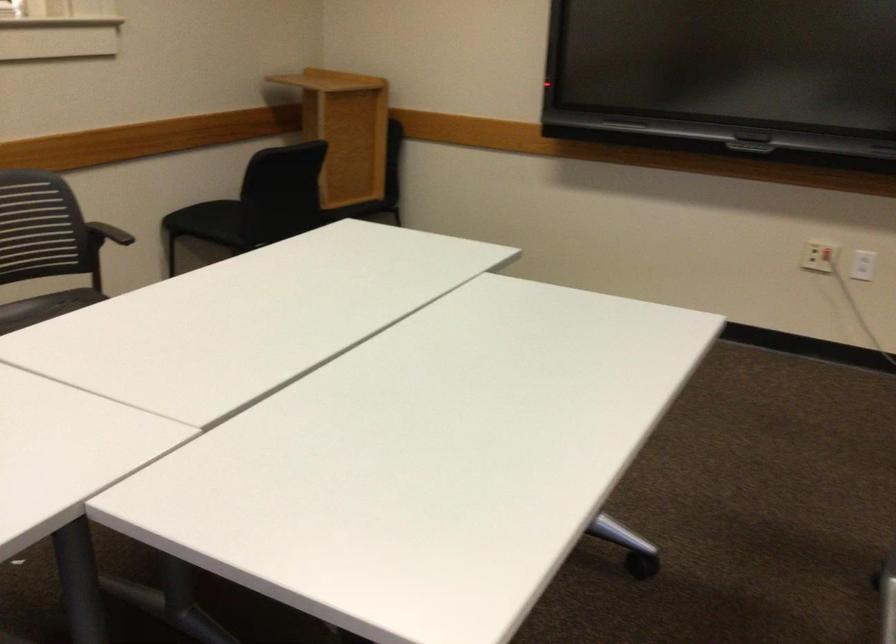
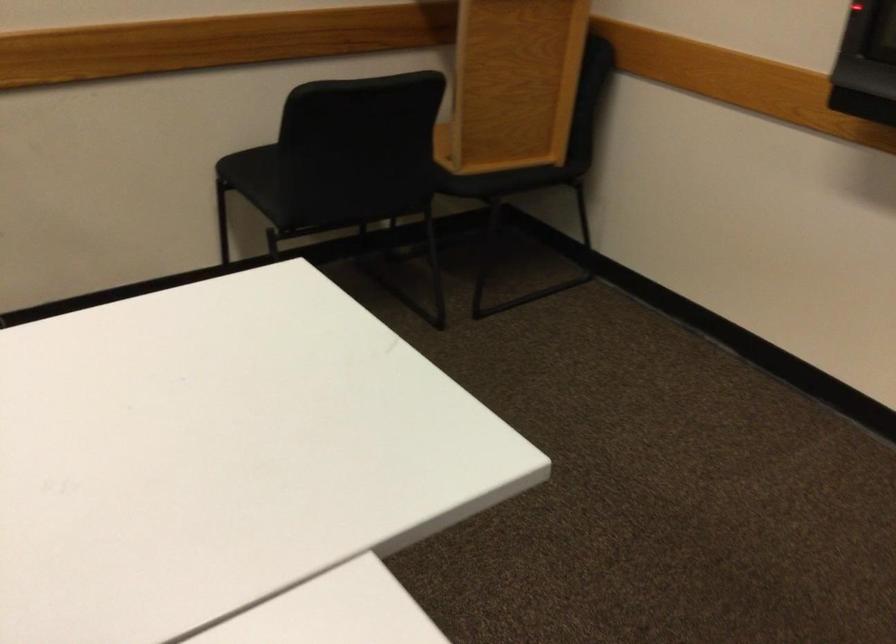
Question: The images are taken continuously from a first-person perspective. In which direction are you moving?

Choices:
 (A) Left
 (B) Right
 (C) Forward
 (D) Backward

Answer: (C)